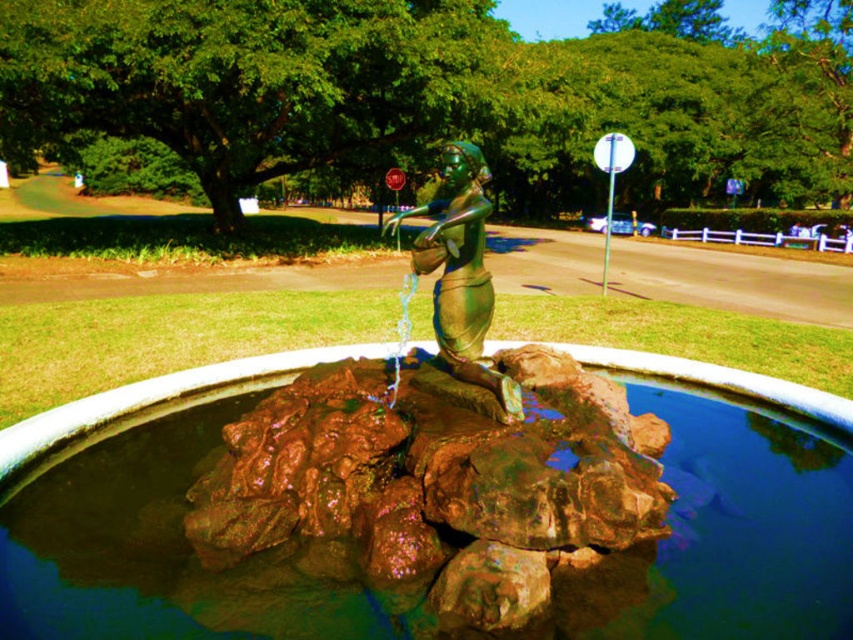
Question: Considering the relative positions of brown stone water at center and green patina bronze figurine at center in the image provided, where is brown stone water at center located with respect to green patina bronze figurine at center?

Choices:
 (A) below
 (B) above

Answer: (A)

Question: Does brown stone water at center appear on the left side of green patina bronze figurine at center?

Choices:
 (A) yes
 (B) no

Answer: (B)

Question: Where is brown stone water at center located in relation to green patina bronze figurine at center in the image?

Choices:
 (A) above
 (B) below

Answer: (B)

Question: Which point is closer to the camera?

Choices:
 (A) green patina bronze figurine at center
 (B) brown stone water at center

Answer: (B)